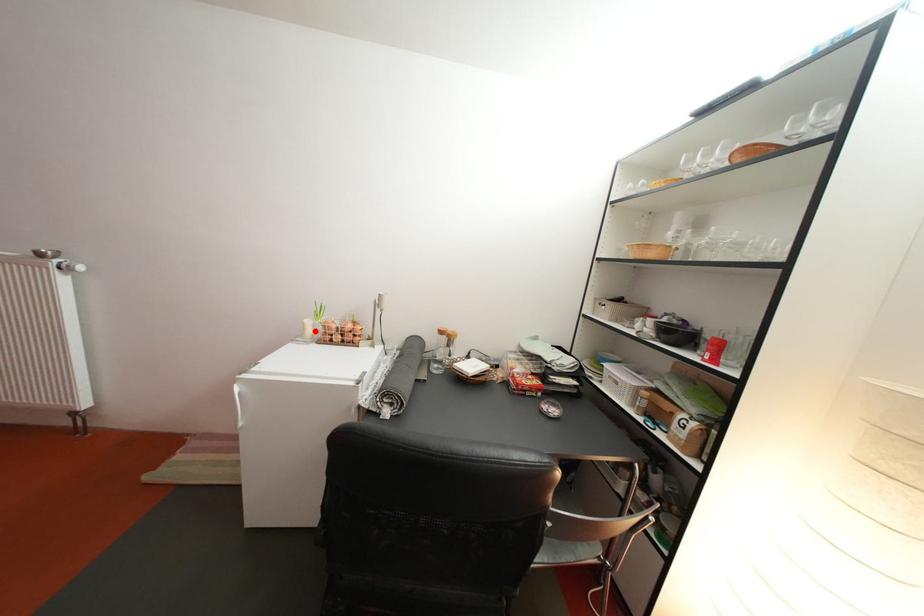
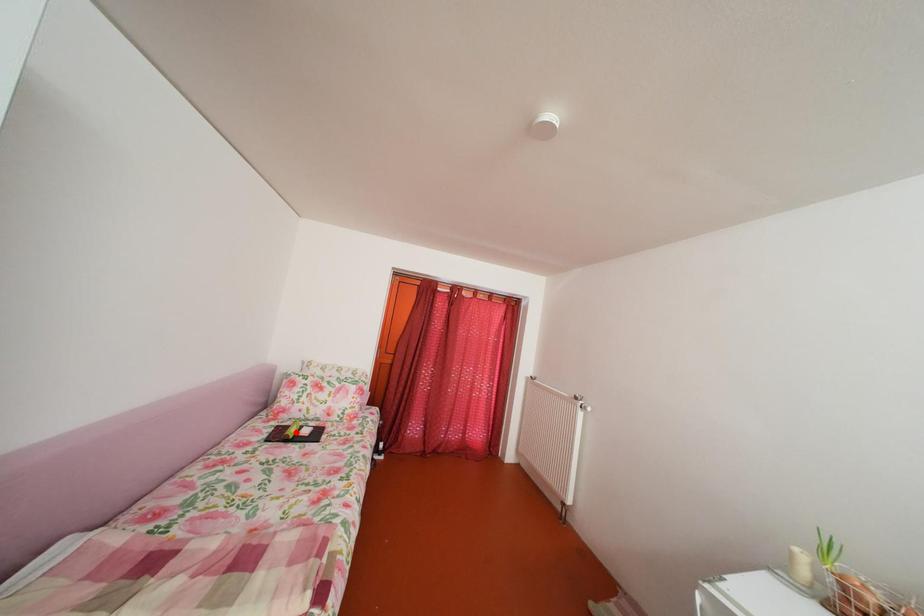
I am providing you with two images of the same scene from different viewpoints. A red point is marked on the first image and another point is marked on the second image. Is the marked point in image1 the same physical position as the marked point in image2?

No